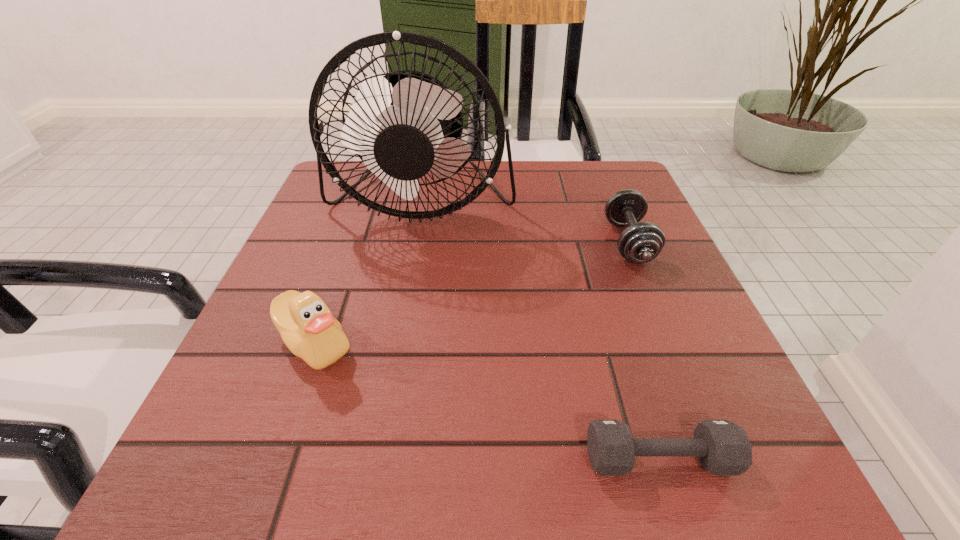
You are a GUI agent. You are given a task and a screenshot of the screen. Output one action in this format:
    pyautogui.click(x=<x>, y=<y>)
    Task: Click on the tallest object
    
    Given the screenshot: What is the action you would take?
    pyautogui.click(x=404, y=125)

Where is `duck`? This screenshot has width=960, height=540. duck is located at coordinates (307, 327).

Locate an element on the screen. The width and height of the screenshot is (960, 540). the third shortest object is located at coordinates (307, 327).

You are a GUI agent. You are given a task and a screenshot of the screen. Output one action in this format:
    pyautogui.click(x=<x>, y=<y>)
    Task: Click on the farther dumbbell
    
    Given the screenshot: What is the action you would take?
    pyautogui.click(x=641, y=242)

The height and width of the screenshot is (540, 960). In order to click on the taller dumbbell in this screenshot , I will do `click(641, 242)`.

Where is `the shorter dumbbell`? This screenshot has height=540, width=960. the shorter dumbbell is located at coordinates (722, 447).

What are the coordinates of `the nearest object` in the screenshot? It's located at (722, 447).

Where is `free space located 0.070m in front of the fan, directing airflow`? free space located 0.070m in front of the fan, directing airflow is located at coordinates click(410, 266).

Locate an element on the screen. Image resolution: width=960 pixels, height=540 pixels. vacant region located 0.120m at the beak of the third shortest object is located at coordinates (275, 455).

The width and height of the screenshot is (960, 540). What are the coordinates of `free region located 0.150m on the back of the farther dumbbell` in the screenshot? It's located at (603, 180).